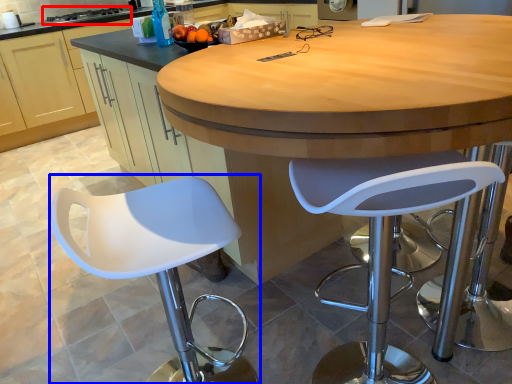
Question: Which point is further to the camera, stove (highlighted by a red box) or chair (highlighted by a blue box)?

Choices:
 (A) stove
 (B) chair

Answer: (A)